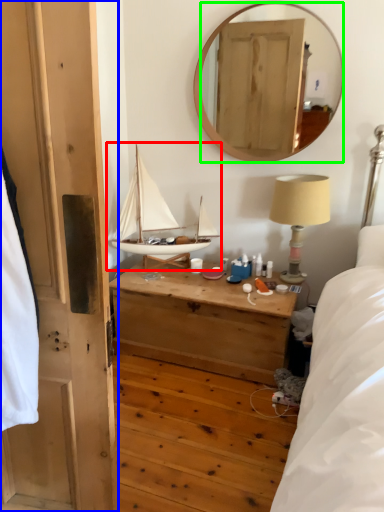
Question: Which object is the closest to the boat (highlighted by a red box)? Choose among these: door (highlighted by a blue box) or mirror (highlighted by a green box).

Choices:
 (A) door
 (B) mirror

Answer: (A)